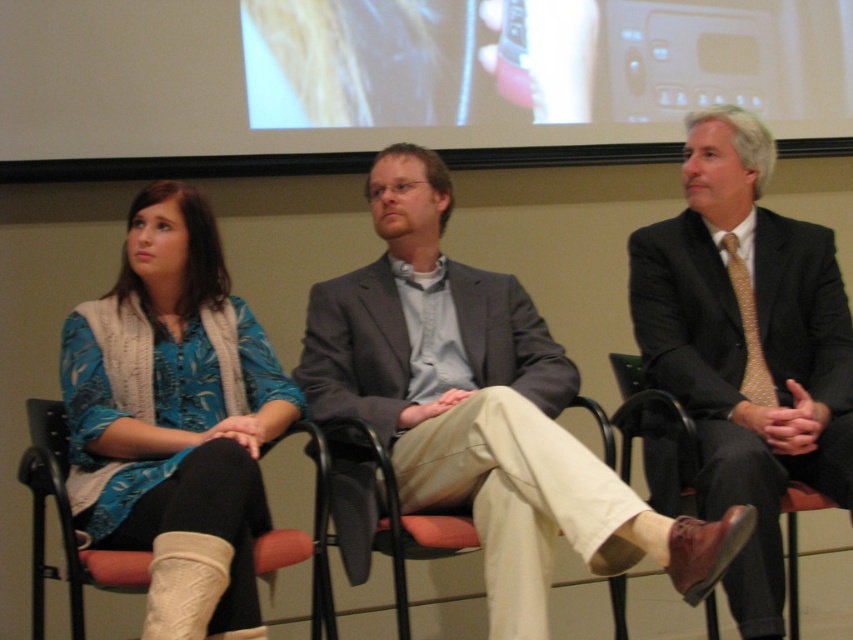
Describe the element at coordinates (173, 419) in the screenshot. I see `knit sweater at left` at that location.

Between knit sweater at left and polished dark suit at center, which one has more height?

With more height is polished dark suit at center.

Image resolution: width=853 pixels, height=640 pixels. I want to click on knit sweater at left, so click(x=173, y=419).

Can you confirm if gray suit at center is smaller than fabric cushioned chair at lower left?

Incorrect, gray suit at center is not smaller in size than fabric cushioned chair at lower left.

Which is below, gray suit at center or fabric cushioned chair at lower left?

fabric cushioned chair at lower left is lower down.

Where is `gray suit at center`? gray suit at center is located at coordinates (482, 408).

What are the coordinates of `gray suit at center` in the screenshot? It's located at (482, 408).

Is point (252, 451) farther from viewer compared to point (316, 508)?

No, (252, 451) is closer to viewer.

Looking at this image, who is more distant from viewer, (167, 461) or (608, 444)?

Positioned behind is point (608, 444).

Describe the element at coordinates (173, 419) in the screenshot. The image size is (853, 640). I see `knit sweater at left` at that location.

Identify the location of knit sweater at left. (173, 419).